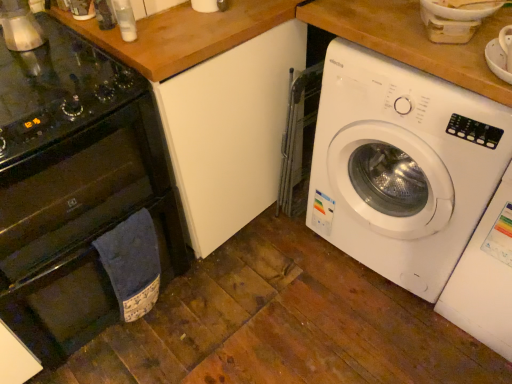
At what (x,y) coordinates should I click in order to perform the action: click on vacant area to the right of black glass oven at left. Please return your answer as a coordinate pair (x, y). This screenshot has height=384, width=512. Looking at the image, I should click on (232, 304).